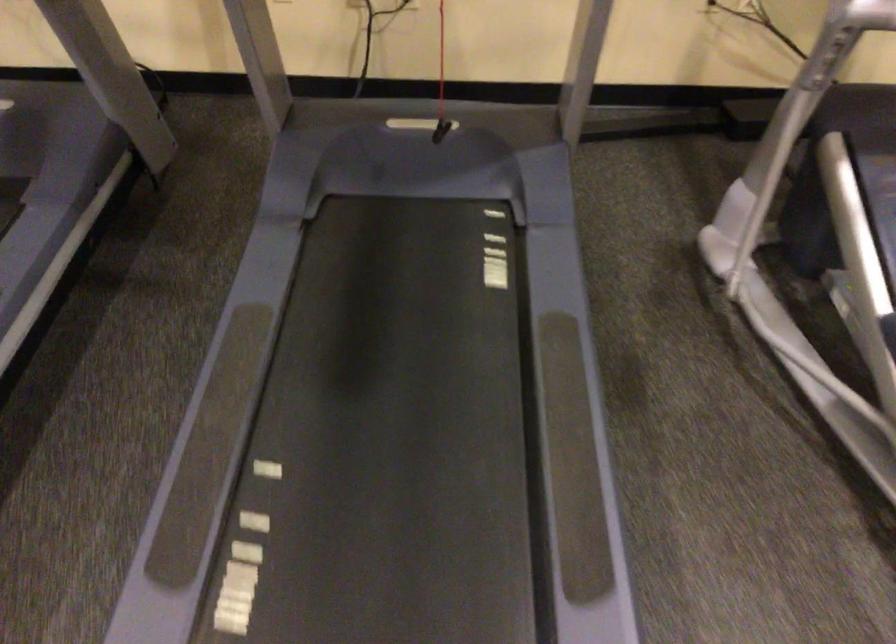
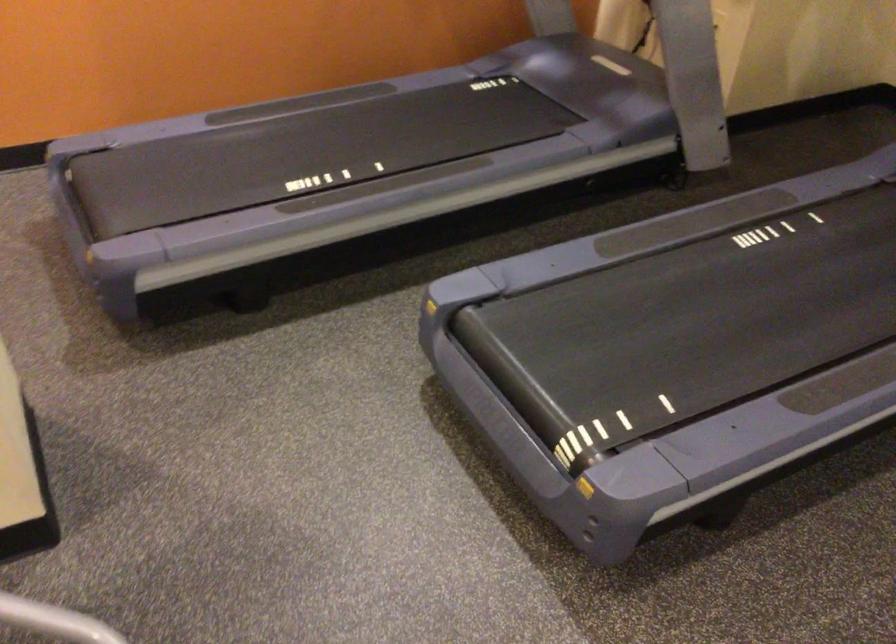
Question: The camera is either moving clockwise (left) or counter-clockwise (right) around the object. The first image is from the beginning of the video and the second image is from the end. Is the camera moving left or right when shooting the video?

Choices:
 (A) Left
 (B) Right

Answer: (B)